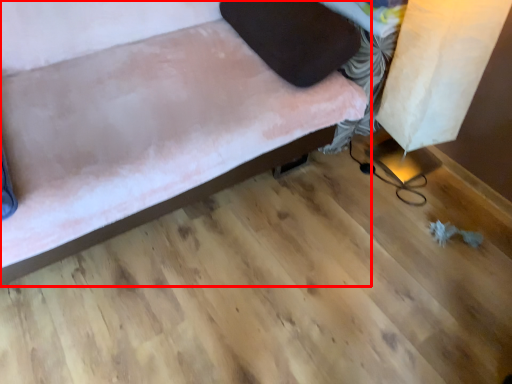
Question: Observing the image, what is the correct spatial positioning of furniture (annotated by the red box) in reference to pillow?

Choices:
 (A) left
 (B) right

Answer: (A)